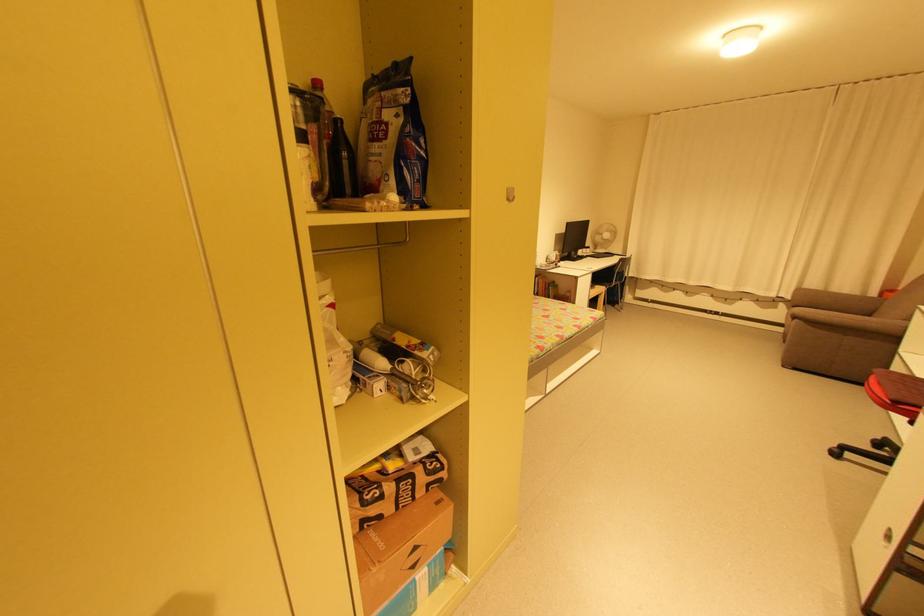
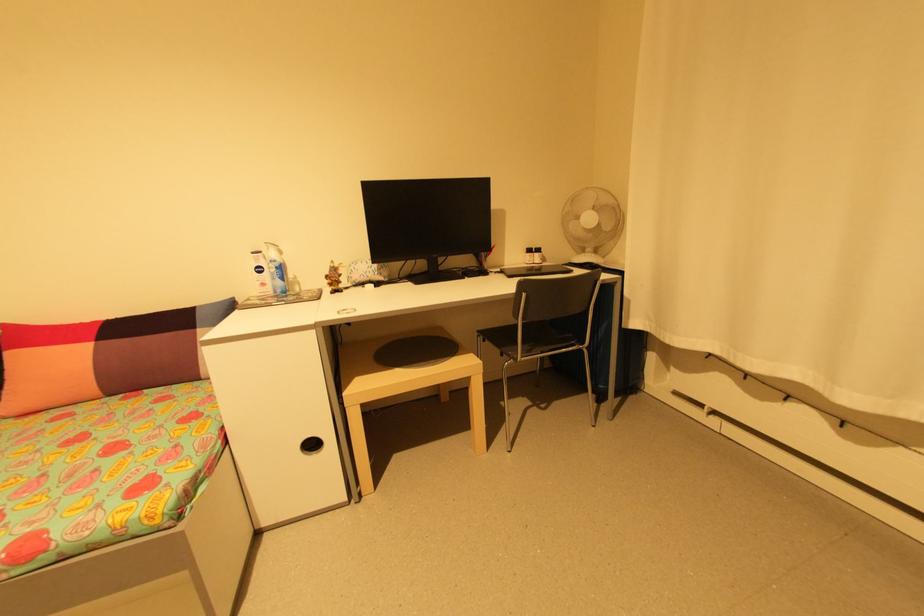
Find the pixel in the second image that matches the point at 623,285 in the first image.

(585, 352)